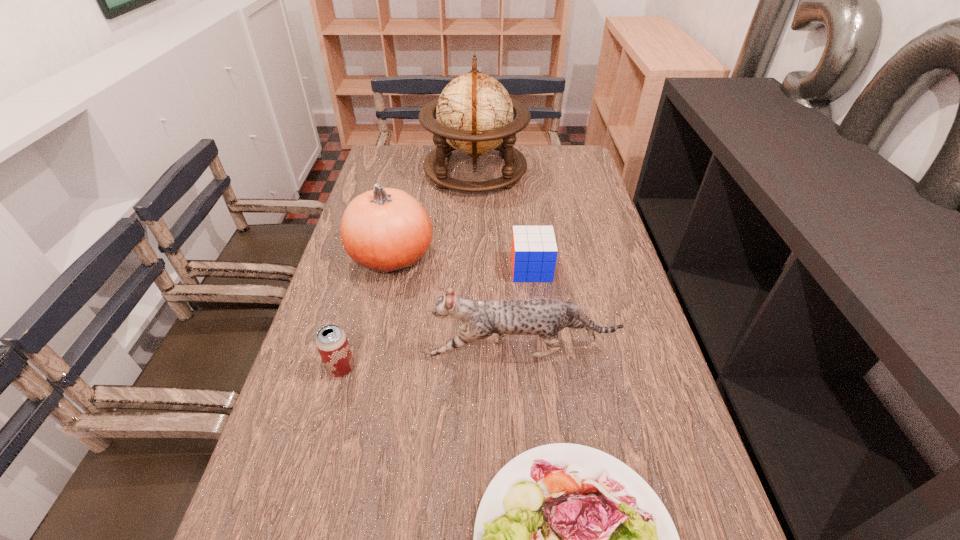
You are a GUI agent. You are given a task and a screenshot of the screen. Output one action in this format:
    pyautogui.click(x=<x>, y=<y>)
    Task: Click on the tallest object
    This screenshot has width=960, height=540.
    Given the screenshot: What is the action you would take?
    pyautogui.click(x=474, y=112)

Where is `the farthest object`? The image size is (960, 540). the farthest object is located at coordinates (474, 112).

Find the location of a particular element. The image size is (960, 540). the second tallest object is located at coordinates (387, 230).

In order to click on the third tallest object in this screenshot , I will do `click(545, 317)`.

Locate an element on the screen. The width and height of the screenshot is (960, 540). beer can is located at coordinates (331, 340).

This screenshot has width=960, height=540. I want to click on cube, so click(534, 251).

This screenshot has width=960, height=540. In order to click on free space located 0.220m on the right of the farthest object in this screenshot , I will do pos(587,171).

Where is `free region located on the right of the fifth shortest object`? The width and height of the screenshot is (960, 540). free region located on the right of the fifth shortest object is located at coordinates (549, 256).

You are a GUI agent. You are given a task and a screenshot of the screen. Output one action in this format:
    pyautogui.click(x=<x>, y=<y>)
    Task: Click on the vacant space positioned on the face of the fourth shortest object
    This screenshot has height=540, width=960.
    Given the screenshot: What is the action you would take?
    pyautogui.click(x=382, y=350)

Image resolution: width=960 pixels, height=540 pixels. Identify the location of vacant space positioned 0.260m on the face of the fourth shortest object. (318, 350).